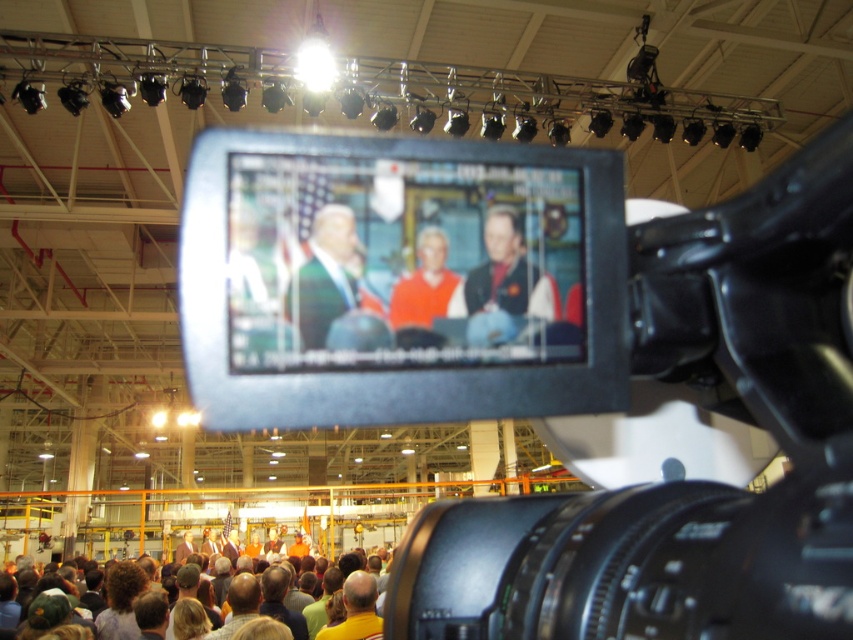
You are a photographer at the event and want to take a photo of the smooth blue shirt at center without the black plastic video camera at center blocking the view. Can you shift your position to the right to achieve this?

The black plastic video camera at center is to the left of the smooth blue shirt at center, so shifting to the right would move the camera out of the way, allowing you to capture the smooth blue shirt at center without obstruction.

You are setting up equipment for a live stream and need to position the matte plastic monitor at center so that it is visible over the orange fabric sweater at center. Based on their sizes, can you place the monitor in a way that its top edge stays above the sweater?

The matte plastic monitor at center has a greater height compared to orange fabric sweater at center, so yes, positioning it properly would allow the monitor to be seen over the sweater since it is taller.